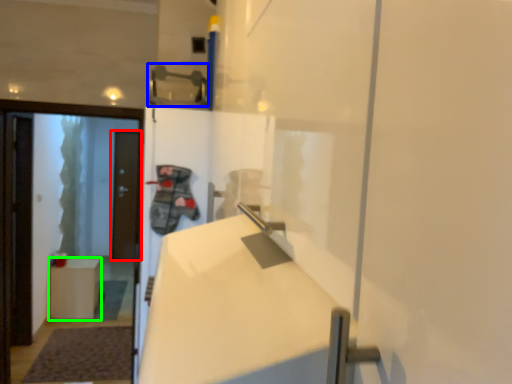
Question: Based on their relative distances, which object is nearer to door (highlighted by a red box)? Choose from door handle (highlighted by a blue box) and furniture (highlighted by a green box).

Choices:
 (A) door handle
 (B) furniture

Answer: (B)